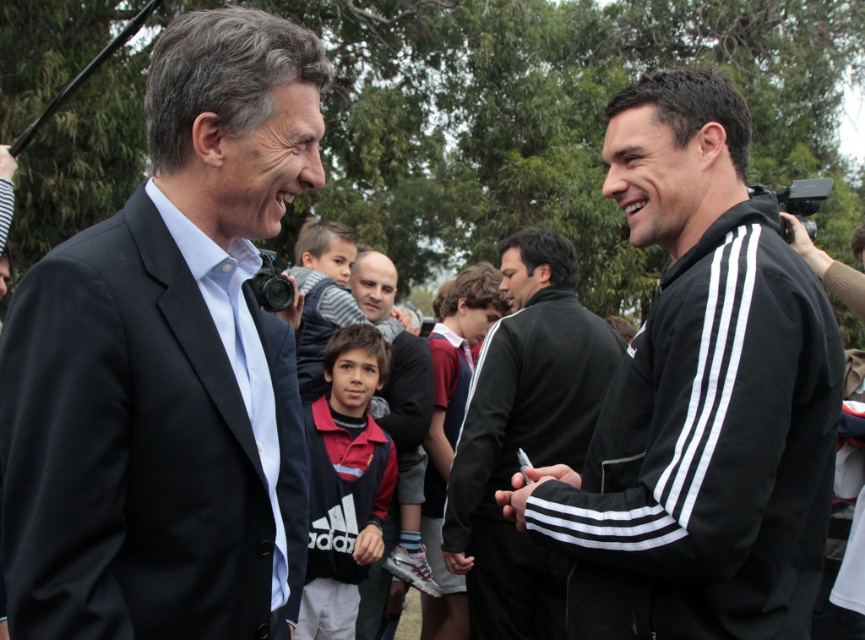
Question: Observing the image, what is the correct spatial positioning of black matte suit at left in reference to dark brown leather jacket at center?

Choices:
 (A) left
 (B) right

Answer: (A)

Question: Is the position of black matte jacket at center more distant than that of dark brown leather jacket at center?

Choices:
 (A) yes
 (B) no

Answer: (B)

Question: Which of the following is the closest to the observer?

Choices:
 (A) (562, 356)
 (B) (431, 486)
 (C) (769, 472)

Answer: (C)

Question: Among these points, which one is nearest to the camera?

Choices:
 (A) [x=347, y=573]
 (B) [x=490, y=301]
 (C) [x=524, y=573]

Answer: (A)

Question: Can you confirm if red adidas bib at center is wider than dark brown leather jacket at center?

Choices:
 (A) yes
 (B) no

Answer: (B)

Question: Which of the following is the farthest from the observer?

Choices:
 (A) (441, 336)
 (B) (578, 376)
 (C) (305, 598)
 (D) (806, 536)

Answer: (A)